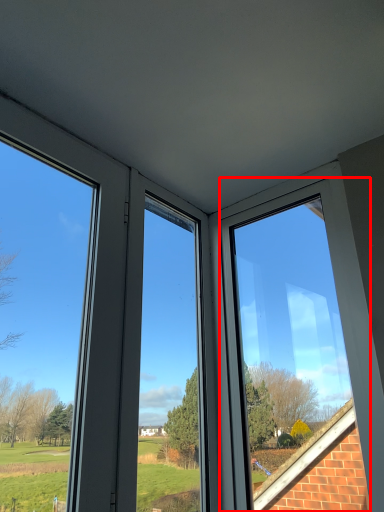
Question: Observing the image, what is the correct spatial positioning of window (annotated by the red box) in reference to window?

Choices:
 (A) right
 (B) left

Answer: (A)